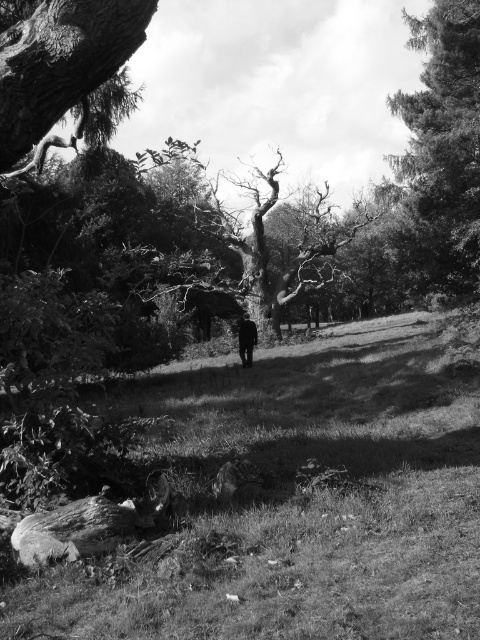
Consider the image. Does smooth green tree at upper right appear on the right side of dark textured bark at upper left?

Yes, smooth green tree at upper right is to the right of dark textured bark at upper left.

Does smooth green tree at upper right have a lesser height compared to dark textured bark at upper left?

Incorrect, smooth green tree at upper right's height does not fall short of dark textured bark at upper left's.

Is point (474, 237) more distant than point (72, 54)?

Yes, point (474, 237) is behind point (72, 54).

At what (x,y) coordinates should I click in order to perform the action: click on smooth green tree at upper right. Please return your answer as a coordinate pair (x, y). The image size is (480, 640). Looking at the image, I should click on (444, 141).

Does grassy field at lower left have a lesser height compared to dark textured bark at upper left?

Incorrect, grassy field at lower left's height does not fall short of dark textured bark at upper left's.

Is grassy field at lower left to the right of dark textured bark at upper left from the viewer's perspective?

Yes, grassy field at lower left is to the right of dark textured bark at upper left.

This screenshot has height=640, width=480. What are the coordinates of `grassy field at lower left` in the screenshot? It's located at (300, 502).

What do you see at coordinates (300, 502) in the screenshot?
I see `grassy field at lower left` at bounding box center [300, 502].

Which is behind, point (414, 400) or point (384, 189)?

The point (384, 189) is behind.

Between point (86, 632) and point (477, 102), which one is positioned in front?

Positioned in front is point (86, 632).

Where is `grassy field at lower left`? Image resolution: width=480 pixels, height=640 pixels. grassy field at lower left is located at coordinates click(300, 502).